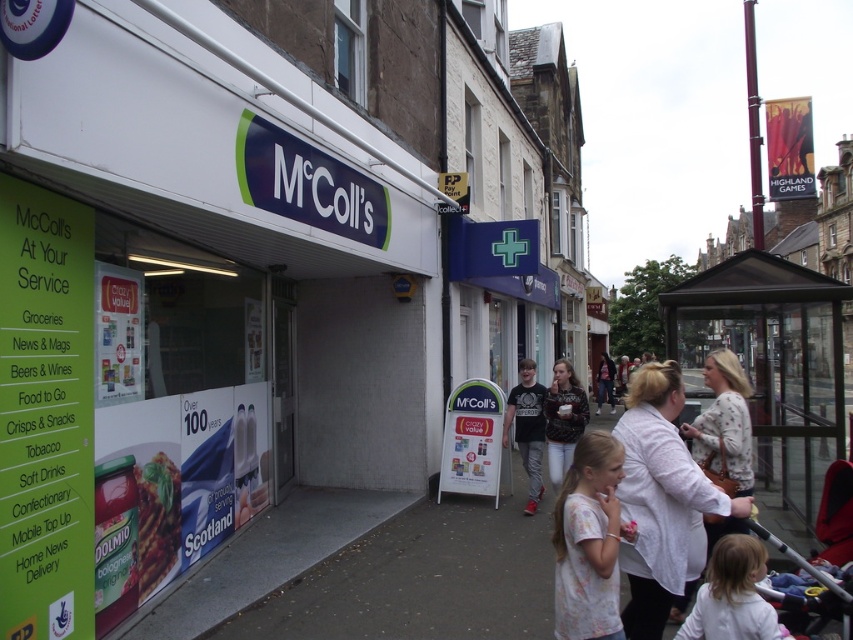
You are a window cleaner standing at the center of the street. You need to clean both the white matte signboard at center and the fluffy sweater at center. Which object should you reach first without moving your position?

The white matte signboard at center has a lesser height compared to the fluffy sweater at center, so you should reach the white matte signboard at center first since it is lower and easier to access from your current position.

You are a customer looking at the shirts displayed in the McColl store window. Which shirt is closer to you, the white cotton shirt at center or the light pink cotton shirt at lower center?

The white cotton shirt at center is closer to you because the light pink cotton shirt at lower center is behind it.

You are a parent holding your child in your arms and see the metallic silver baby carriage at lower right and the fluffy sweater at center. Which object is closer to you?

The metallic silver baby carriage at lower right is closer to you because it is in front of the fluffy sweater at center.